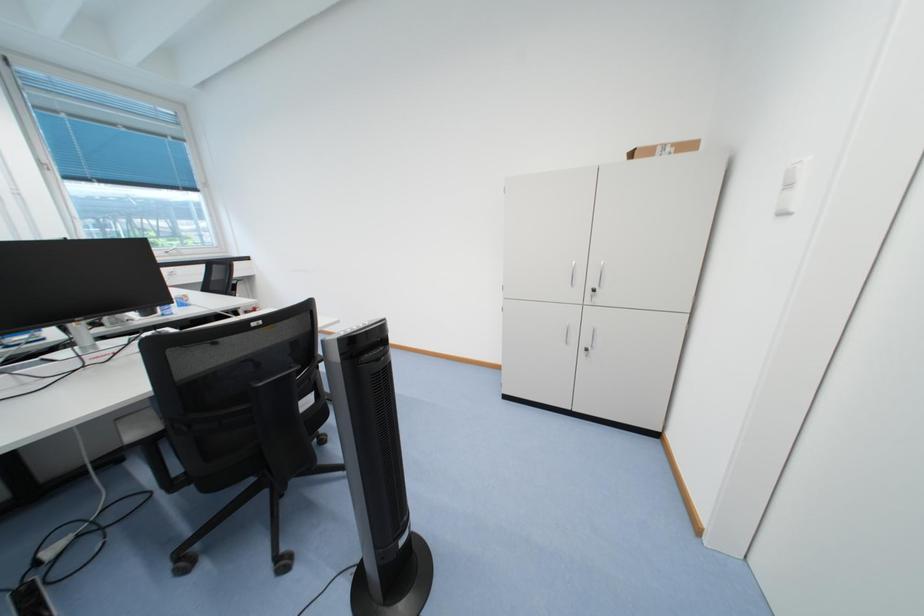
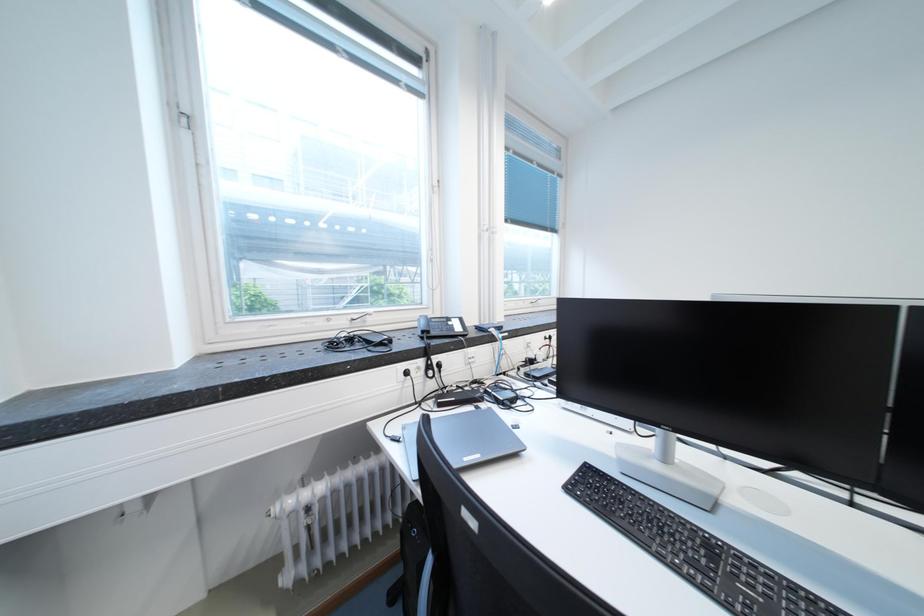
Question: The images are taken continuously from a first-person perspective. In which direction are you moving?

Choices:
 (A) Left
 (B) Right
 (C) Forward
 (D) Backward

Answer: (A)